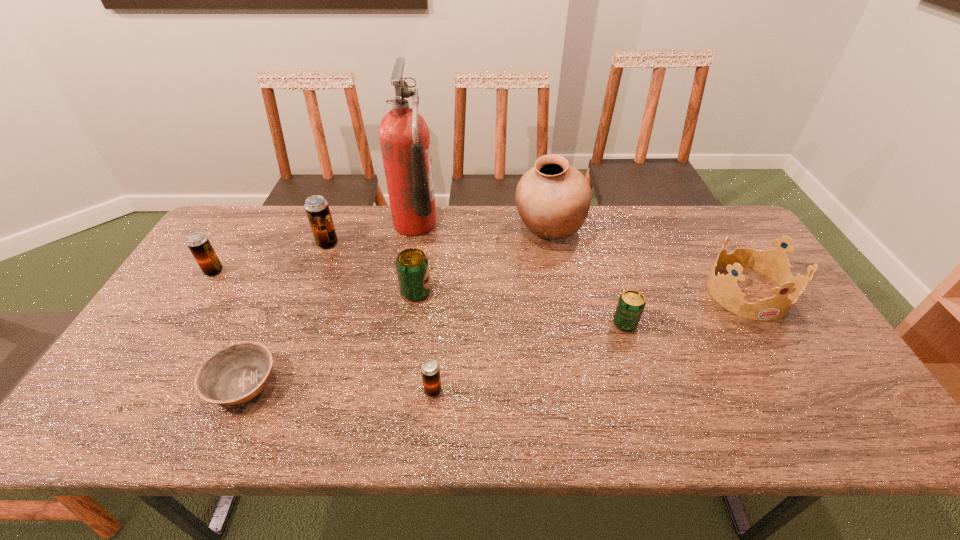
Where is `object that is at the right edge`? The image size is (960, 540). object that is at the right edge is located at coordinates (773, 263).

In the image, there is a desktop. Where is `vacant space at the far edge`? The image size is (960, 540). vacant space at the far edge is located at coordinates (588, 219).

Image resolution: width=960 pixels, height=540 pixels. I want to click on free spot at the near edge of the desktop, so click(711, 402).

The height and width of the screenshot is (540, 960). Identify the location of vacant space at the left edge of the desktop. (184, 315).

The image size is (960, 540). In the image, there is a desktop. In order to click on vacant space at the right edge in this screenshot , I will do pos(760,274).

Where is `free space at the near left corner of the desktop`? free space at the near left corner of the desktop is located at coordinates (109, 424).

Image resolution: width=960 pixels, height=540 pixels. Find the location of `vacant space at the far right corner of the desktop`. vacant space at the far right corner of the desktop is located at coordinates (732, 230).

You are a GUI agent. You are given a task and a screenshot of the screen. Output one action in this format:
    pyautogui.click(x=<x>, y=<y>)
    Task: Click on the empty space that is in between the nearest beer can and the third object from right to left
    
    Given the screenshot: What is the action you would take?
    pyautogui.click(x=491, y=310)

The width and height of the screenshot is (960, 540). What are the coordinates of `unoccupied position between the pottery and the tallest object` in the screenshot? It's located at (482, 227).

I want to click on vacant area between the second tallest object and the farther green beer can, so click(x=482, y=261).